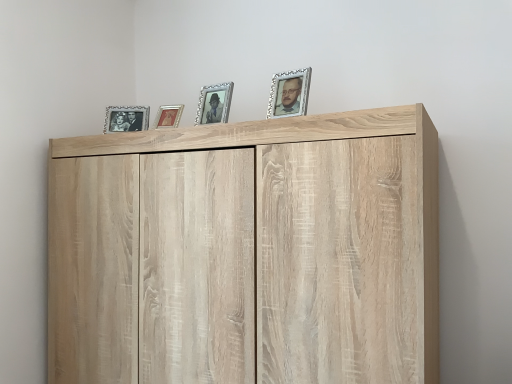
This screenshot has height=384, width=512. What do you see at coordinates (126, 118) in the screenshot? I see `matte silver picture frame at upper left, which is the fourth picture frame from front to back` at bounding box center [126, 118].

Where is `silver/glass picture frame at center, the third picture frame in the left-to-right sequence`? Image resolution: width=512 pixels, height=384 pixels. silver/glass picture frame at center, the third picture frame in the left-to-right sequence is located at coordinates (214, 103).

Consider the image. Is light wood cupboard at upper center to the left or to the right of matte silver picture frame at upper left, which is the 1th picture frame from back to front, in the image?

Based on their positions, light wood cupboard at upper center is located to the right of matte silver picture frame at upper left, which is the 1th picture frame from back to front.

Which is closer, [330,170] or [139,122]?

Point [330,170]

Which of these two, light wood cupboard at upper center or matte silver picture frame at upper left, which ranks as the fourth picture frame in right-to-left order, is smaller?

Smaller between the two is matte silver picture frame at upper left, which ranks as the fourth picture frame in right-to-left order.

Can you confirm if light wood cupboard at upper center is thinner than silver/glass picture frame at center, the second picture frame from the right?

Incorrect, the width of light wood cupboard at upper center is not less than that of silver/glass picture frame at center, the second picture frame from the right.

Which of these two, light wood cupboard at upper center or silver/glass picture frame at center, the third picture frame in the left-to-right sequence, is smaller?

silver/glass picture frame at center, the third picture frame in the left-to-right sequence, is smaller.

Consider the image. Would you say light wood cupboard at upper center is a long distance from silver/glass picture frame at center, the second picture frame from the right?

light wood cupboard at upper center is near silver/glass picture frame at center, the second picture frame from the right, not far away.

From a real-world perspective, which is physically above, matte silver picture frame at upper left, which ranks as the fourth picture frame in right-to-left order, or metallic gold picture frame at center, the 3th picture frame viewed from the front?

matte silver picture frame at upper left, which ranks as the fourth picture frame in right-to-left order, is physically above.

Is metallic gold picture frame at center, the 2th picture frame from the left, at the back of matte silver picture frame at upper left, which ranks as the fourth picture frame in right-to-left order?

No, matte silver picture frame at upper left, which ranks as the fourth picture frame in right-to-left order, is not facing away from metallic gold picture frame at center, the 2th picture frame from the left.

How many degrees apart are the facing directions of matte silver picture frame at upper left, which ranks as the fourth picture frame in right-to-left order, and metallic gold picture frame at center, the third picture frame viewed from the right?

They differ by 0.0259 degrees in their facing directions.

Between matte silver picture frame at upper left, which is the fourth picture frame from front to back, and metallic gold picture frame at center, placed as the 2th picture frame when sorted from back to front, which one has more height?

matte silver picture frame at upper left, which is the fourth picture frame from front to back.

The height and width of the screenshot is (384, 512). I want to click on the 3rd picture frame in front of the matte silver picture frame at upper left, which is the fourth picture frame from front to back, so click(x=289, y=93).

Between silver/glass picture frame at upper right, placed as the 4th picture frame when sorted from left to right, and matte silver picture frame at upper left, which is the 1th picture frame from back to front, which one has smaller width?

silver/glass picture frame at upper right, placed as the 4th picture frame when sorted from left to right, is thinner.

Can you confirm if silver/glass picture frame at upper right, the 4th picture frame when ordered from back to front, is positioned to the right of matte silver picture frame at upper left, which is the fourth picture frame from front to back?

Yes, silver/glass picture frame at upper right, the 4th picture frame when ordered from back to front, is to the right of matte silver picture frame at upper left, which is the fourth picture frame from front to back.

Is the position of silver/glass picture frame at upper right, the first picture frame in the right-to-left sequence, less distant than that of matte silver picture frame at upper left, which is the fourth picture frame from front to back?

Yes, it is in front of matte silver picture frame at upper left, which is the fourth picture frame from front to back.

Is silver/glass picture frame at center, the second picture frame from the right, at the back of metallic gold picture frame at center, the third picture frame viewed from the right?

No, metallic gold picture frame at center, the third picture frame viewed from the right, is not facing the opposite direction of silver/glass picture frame at center, the second picture frame from the right.

Is metallic gold picture frame at center, the 2th picture frame from the left, outside of silver/glass picture frame at center, placed as the 2th picture frame when sorted from front to back?

metallic gold picture frame at center, the 2th picture frame from the left, lies outside silver/glass picture frame at center, placed as the 2th picture frame when sorted from front to back,'s area.

Which of these two, metallic gold picture frame at center, the third picture frame viewed from the right, or silver/glass picture frame at center, acting as the third picture frame starting from the back, is smaller?

With smaller size is metallic gold picture frame at center, the third picture frame viewed from the right.

Would you say metallic gold picture frame at center, placed as the 2th picture frame when sorted from back to front, is a long distance from silver/glass picture frame at center, placed as the 2th picture frame when sorted from front to back?

No, metallic gold picture frame at center, placed as the 2th picture frame when sorted from back to front, is not far from silver/glass picture frame at center, placed as the 2th picture frame when sorted from front to back.

Can you confirm if silver/glass picture frame at upper right, the 4th picture frame when ordered from back to front, is positioned to the right of metallic gold picture frame at center, the 3th picture frame viewed from the front?

Yes.

Can you confirm if silver/glass picture frame at upper right, placed as the 4th picture frame when sorted from left to right, is taller than metallic gold picture frame at center, placed as the 2th picture frame when sorted from back to front?

Correct, silver/glass picture frame at upper right, placed as the 4th picture frame when sorted from left to right, is much taller as metallic gold picture frame at center, placed as the 2th picture frame when sorted from back to front.

Is metallic gold picture frame at center, the 2th picture frame from the left, at the back of silver/glass picture frame at upper right, the 4th picture frame when ordered from back to front?

That's not correct — silver/glass picture frame at upper right, the 4th picture frame when ordered from back to front, is not looking away from metallic gold picture frame at center, the 2th picture frame from the left.

Is silver/glass picture frame at upper right, the first picture frame in the right-to-left sequence, smaller than metallic gold picture frame at center, the 3th picture frame viewed from the front?

No, silver/glass picture frame at upper right, the first picture frame in the right-to-left sequence, is not smaller than metallic gold picture frame at center, the 3th picture frame viewed from the front.

Based on the photo, is silver/glass picture frame at upper right, the first picture frame in the right-to-left sequence, aimed at silver/glass picture frame at center, the second picture frame from the right?

No, silver/glass picture frame at upper right, the first picture frame in the right-to-left sequence, is not aimed at silver/glass picture frame at center, the second picture frame from the right.

Which is in front, point (294, 79) or point (197, 122)?

Positioned in front is point (294, 79).

Is the position of silver/glass picture frame at upper right, the first picture frame in the right-to-left sequence, less distant than that of silver/glass picture frame at center, placed as the 2th picture frame when sorted from front to back?

Yes, silver/glass picture frame at upper right, the first picture frame in the right-to-left sequence, is in front of silver/glass picture frame at center, placed as the 2th picture frame when sorted from front to back.

Measure the distance between silver/glass picture frame at upper right, placed as the 4th picture frame when sorted from left to right, and silver/glass picture frame at center, placed as the 2th picture frame when sorted from front to back.

silver/glass picture frame at upper right, placed as the 4th picture frame when sorted from left to right, is 8.89 inches away from silver/glass picture frame at center, placed as the 2th picture frame when sorted from front to back.

The height and width of the screenshot is (384, 512). What are the coordinates of `the 2nd picture frame positioned above the light wood cupboard at upper center (from the image's perspective)` in the screenshot? It's located at (126, 118).

Where is `the 1st picture frame counting from the left side of the light wood cupboard at upper center`? The image size is (512, 384). the 1st picture frame counting from the left side of the light wood cupboard at upper center is located at coordinates (214, 103).

Based on their spatial positions, is metallic gold picture frame at center, the 2th picture frame from the left, or silver/glass picture frame at upper right, the first picture frame in the right-to-left sequence, further from silver/glass picture frame at center, the second picture frame from the right?

metallic gold picture frame at center, the 2th picture frame from the left, is positioned further to the anchor silver/glass picture frame at center, the second picture frame from the right.

Which object lies further to the anchor point metallic gold picture frame at center, placed as the 2th picture frame when sorted from back to front, silver/glass picture frame at upper right, placed as the 4th picture frame when sorted from left to right, or silver/glass picture frame at center, the second picture frame from the right?

Among the two, silver/glass picture frame at upper right, placed as the 4th picture frame when sorted from left to right, is located further to metallic gold picture frame at center, placed as the 2th picture frame when sorted from back to front.

Considering their positions, is light wood cupboard at upper center positioned closer to silver/glass picture frame at upper right, the first picture frame in the right-to-left sequence, than silver/glass picture frame at center, the second picture frame from the right?

silver/glass picture frame at center, the second picture frame from the right, is positioned closer to the anchor silver/glass picture frame at upper right, the first picture frame in the right-to-left sequence.

Estimate the real-world distances between objects in this image. Which object is further from silver/glass picture frame at upper right, placed as the 4th picture frame when sorted from left to right, light wood cupboard at upper center or metallic gold picture frame at center, the 2th picture frame from the left?

metallic gold picture frame at center, the 2th picture frame from the left.

Estimate the real-world distances between objects in this image. Which object is closer to silver/glass picture frame at upper right, the first picture frame in the right-to-left sequence, silver/glass picture frame at center, acting as the third picture frame starting from the back, or light wood cupboard at upper center?

silver/glass picture frame at center, acting as the third picture frame starting from the back.

Estimate the real-world distances between objects in this image. Which object is further from silver/glass picture frame at upper right, the 4th picture frame when ordered from back to front, matte silver picture frame at upper left, which is the fourth picture frame from front to back, or light wood cupboard at upper center?

matte silver picture frame at upper left, which is the fourth picture frame from front to back, is positioned further to the anchor silver/glass picture frame at upper right, the 4th picture frame when ordered from back to front.

Considering their positions, is metallic gold picture frame at center, placed as the 2th picture frame when sorted from back to front, positioned closer to silver/glass picture frame at upper right, the first picture frame in the right-to-left sequence, than silver/glass picture frame at center, the third picture frame in the left-to-right sequence?

Among the two, silver/glass picture frame at center, the third picture frame in the left-to-right sequence, is located nearer to silver/glass picture frame at upper right, the first picture frame in the right-to-left sequence.

Based on their spatial positions, is silver/glass picture frame at center, acting as the third picture frame starting from the back, or matte silver picture frame at upper left, which ranks as the fourth picture frame in right-to-left order, closer to silver/glass picture frame at upper right, placed as the 4th picture frame when sorted from left to right?

silver/glass picture frame at center, acting as the third picture frame starting from the back, lies closer to silver/glass picture frame at upper right, placed as the 4th picture frame when sorted from left to right, than the other object.

At what (x,y) coordinates should I click in order to perform the action: click on picture frame located between matte silver picture frame at upper left, which is the 1th picture frame from back to front, and silver/glass picture frame at center, placed as the 2th picture frame when sorted from front to back, in the left-right direction. Please return your answer as a coordinate pair (x, y). Looking at the image, I should click on (168, 116).

Locate an element on the screen. This screenshot has height=384, width=512. picture frame between matte silver picture frame at upper left, which ranks as the fourth picture frame in right-to-left order, and light wood cupboard at upper center vertically is located at coordinates (168, 116).

At what (x,y) coordinates should I click in order to perform the action: click on picture frame situated between metallic gold picture frame at center, the 3th picture frame viewed from the front, and silver/glass picture frame at upper right, placed as the 4th picture frame when sorted from left to right, from left to right. Please return your answer as a coordinate pair (x, y). Looking at the image, I should click on (214, 103).